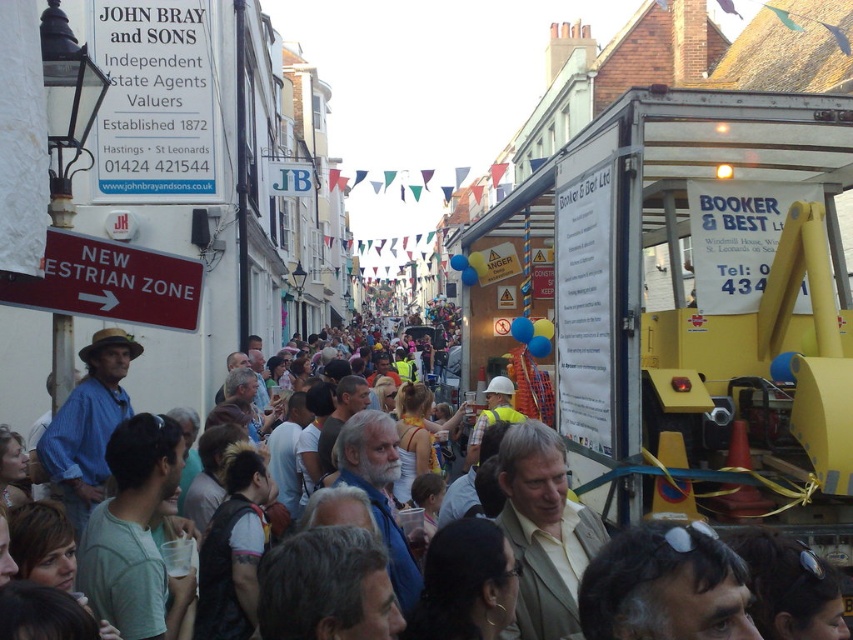
You are standing on the street and see the yellow plastic construction equipment at center. If you walk straight ahead, will you eventually reach the John Bray and Sons sign on the left or the NEW ESTRIAN ZONE sign on the right?

The yellow plastic construction equipment at center is 24.44 meters away from you. Since the John Bray and Sons sign is on the left and the NEW ESTRIAN ZONE sign is on the right, walking straight ahead would keep you in the center path. Therefore, you would pass the yellow plastic construction equipment at center first before reaching either sign, but neither sign is directly in your path. However, based on the arrow direction on the NEW ESTRIAN ZONE sign pointing right, it might indicate the direction of a

You are a pedestrian standing in the middle of the street. You see the yellow plastic construction equipment at center and the multicolored fabric crowd at center. Which object is located to your right?

The yellow plastic construction equipment at center is positioned on the right side of the multicolored fabric crowd at center, so it would be to your right.